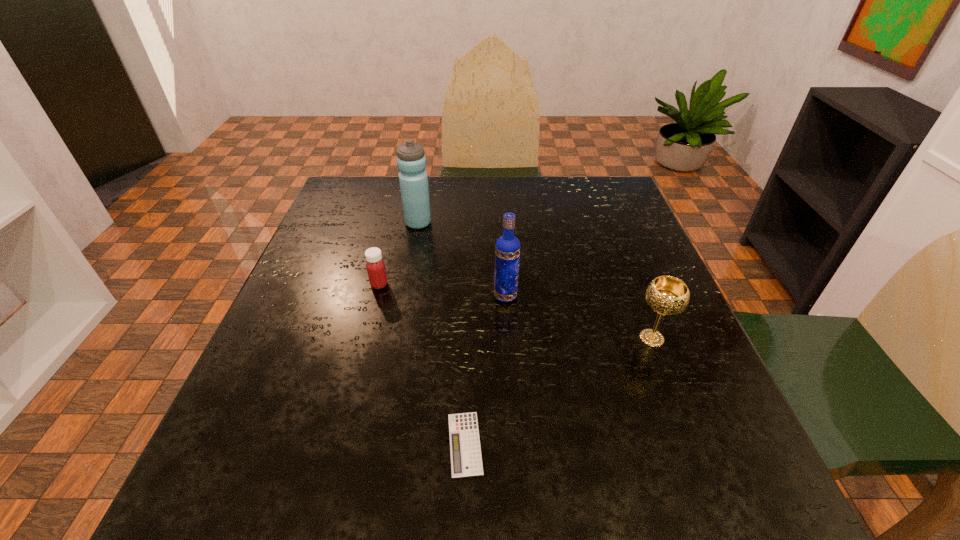
Where is `free spot located 0.190m on the left of the fourth object from left to right`? Image resolution: width=960 pixels, height=540 pixels. free spot located 0.190m on the left of the fourth object from left to right is located at coordinates (403, 296).

You are a GUI agent. You are given a task and a screenshot of the screen. Output one action in this format:
    pyautogui.click(x=<x>, y=<y>)
    Task: Click on the free space located 0.370m on the left of the third tallest object
    
    Given the screenshot: What is the action you would take?
    pyautogui.click(x=438, y=339)

You are a GUI agent. You are given a task and a screenshot of the screen. Output one action in this format:
    pyautogui.click(x=<x>, y=<y>)
    Task: Click on the free space located on the right of the second shortest object
    This screenshot has height=540, width=960.
    Given the screenshot: What is the action you would take?
    pyautogui.click(x=439, y=285)

I want to click on free space located 0.140m on the back of the third object from left to right, so click(x=468, y=346).

I want to click on object that is at the far edge, so click(x=411, y=161).

Identify the location of object positioned at the near edge. This screenshot has width=960, height=540. (465, 450).

What are the coordinates of `object at the right edge` in the screenshot? It's located at (666, 295).

Find the location of a particular element. The height and width of the screenshot is (540, 960). vacant region at the far edge of the desktop is located at coordinates (450, 199).

In the image, there is a desktop. Where is `free space at the near edge`? free space at the near edge is located at coordinates (420, 515).

In the image, there is a desktop. In order to click on vacant space at the left edge in this screenshot , I will do `click(374, 230)`.